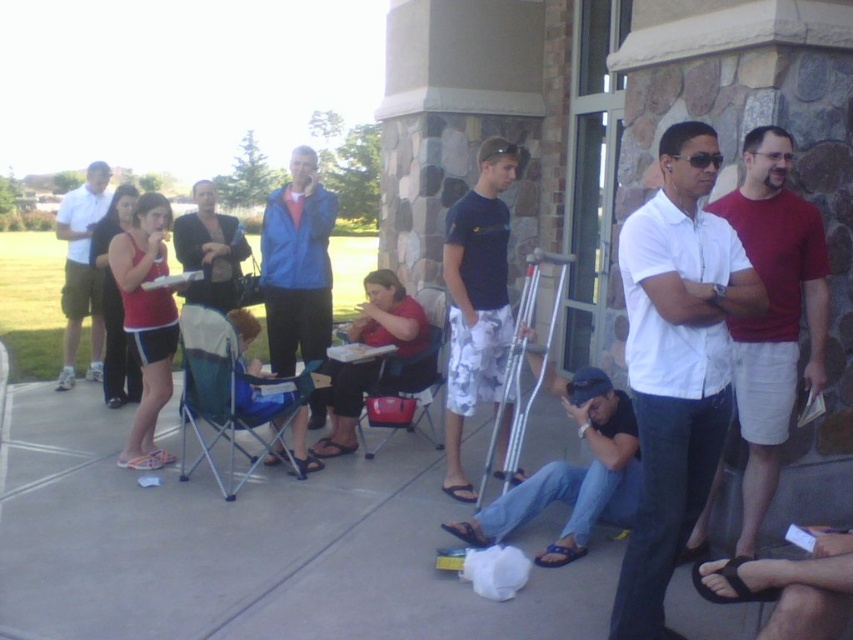
Question: Does white matte shorts at left have a greater width compared to blue fabric chair at center?

Choices:
 (A) no
 (B) yes

Answer: (B)

Question: Among these points, which one is nearest to the camera?

Choices:
 (A) (84, 241)
 (B) (728, 221)

Answer: (B)

Question: Observing the image, what is the correct spatial positioning of denim jeans at lower center in reference to blue fabric folding chair at center?

Choices:
 (A) below
 (B) above

Answer: (A)

Question: Which of the following is the closest to the observer?

Choices:
 (A) denim jeans at lower center
 (B) blue fabric folding chair at center
 (C) white cotton shirt at right

Answer: (C)

Question: Which object is positioned closest to the dark blue t-shirt at center?

Choices:
 (A) dark blue shirt at center
 (B) white cotton shirt at center
 (C) blue fabric folding chair at center
 (D) black fabric sandal at lower right

Answer: (C)

Question: In this image, where is dark blue t-shirt at center located relative to black fabric sandal at lower right?

Choices:
 (A) right
 (B) left

Answer: (B)